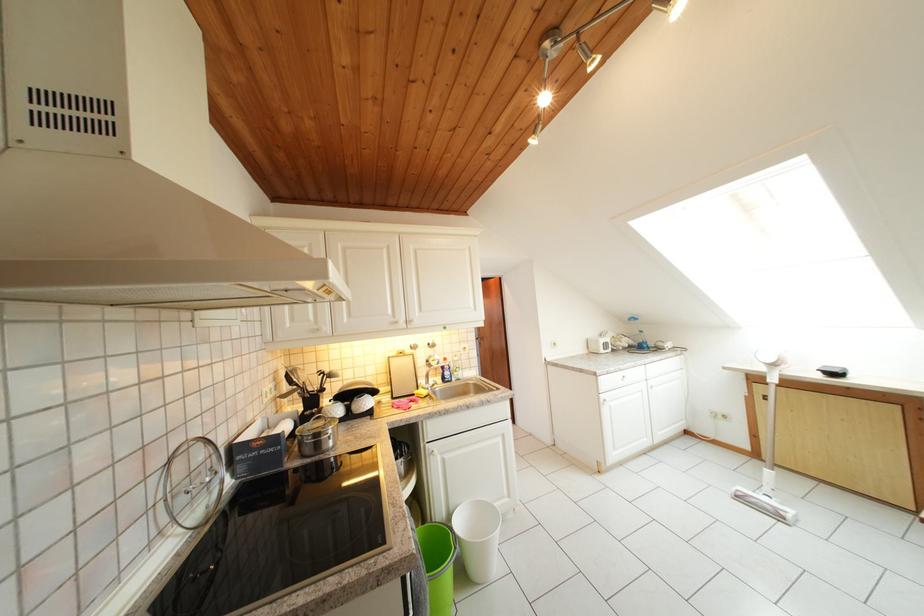
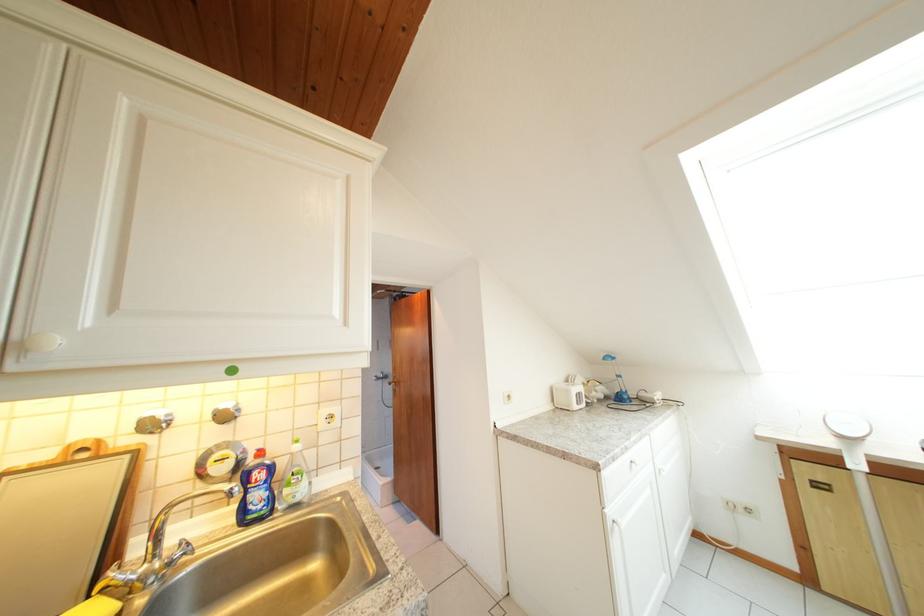
Question: In a continuous first-person perspective shot, in which direction is the camera moving?

Choices:
 (A) Left
 (B) Right
 (C) Forward
 (D) Backward

Answer: (C)